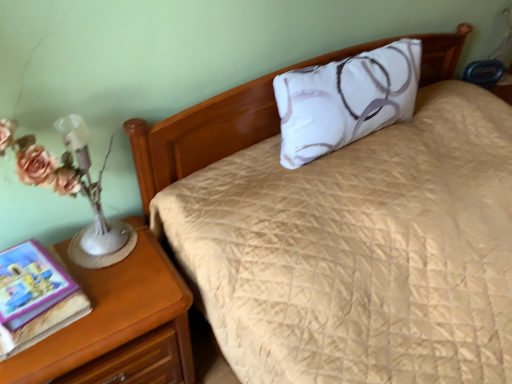
Question: Considering the positions of hardcover book at left and wooden nightstand at lower left in the image, is hardcover book at left wider or thinner than wooden nightstand at lower left?

Choices:
 (A) thin
 (B) wide

Answer: (A)

Question: Is hardcover book at left bigger or smaller than wooden nightstand at lower left?

Choices:
 (A) big
 (B) small

Answer: (B)

Question: Which object is positioned closest to the wooden nightstand at lower left?

Choices:
 (A) hardcover book at left
 (B) white satin pillow at center

Answer: (A)

Question: Estimate the real-world distances between objects in this image. Which object is farther from the wooden nightstand at lower left?

Choices:
 (A) white satin pillow at center
 (B) hardcover book at left

Answer: (A)